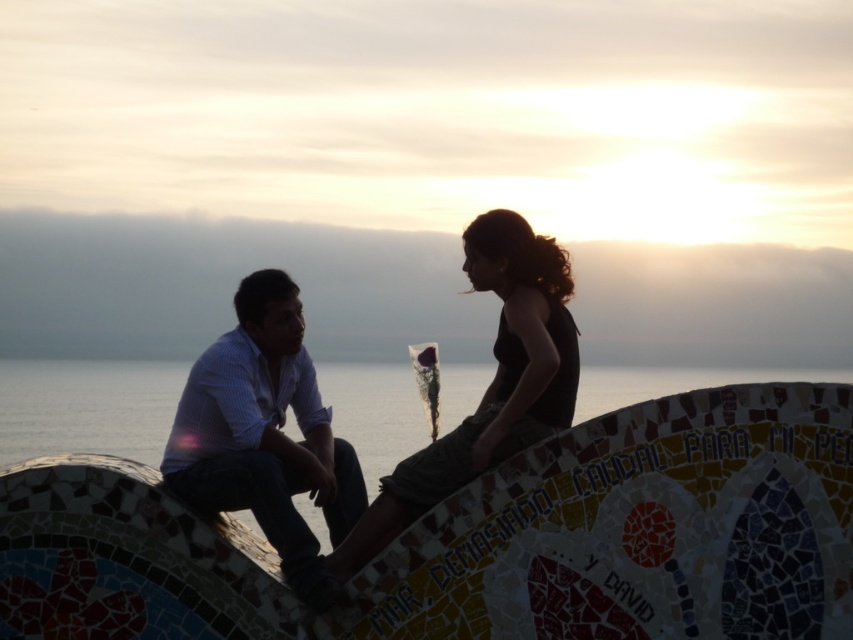
You are a photographer trying to capture the sunset scene. You notice the matte white shirt at left and the silhouette fabric at center. Which object should you focus on first if you want to ensure both are in sharp focus?

You should focus on the matte white shirt at left first because it is closer to the viewer than the silhouette fabric at center, ensuring both will be in focus when using a shallow depth of field.

You are a photographer trying to capture the sunset scene. You notice the transparent glass water at center and the silhouette fabric at center. Which object would you focus on if you want to ensure the wider subject is in the frame?

The transparent glass water at center has a larger width than the silhouette fabric at center, so focusing on it would ensure the wider subject is captured in the frame.

You are standing at the point with coordinates point (368, 518) and want to walk towards the point with coordinates point (167, 412). In which direction should you move relative to your current position?

You should move backward because point (167, 412) is behind point (368, 518).